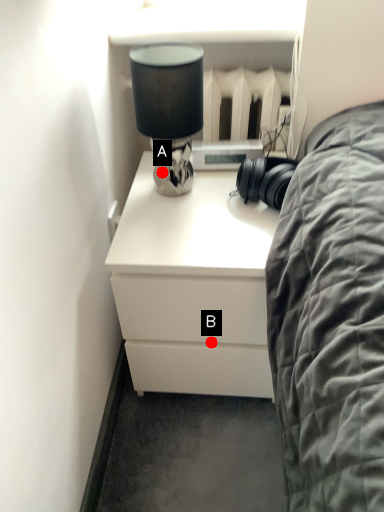
Question: Two points are circled on the image, labeled by A and B beside each circle. Which point appears farthest from the camera in this image?

Choices:
 (A) A is further
 (B) B is further

Answer: (A)